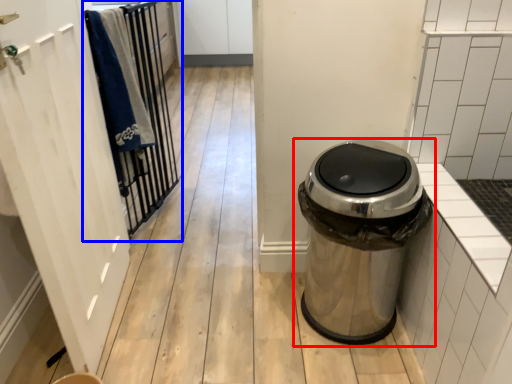
Question: Which point is closer to the camera, waste container (highlighted by a red box) or closet (highlighted by a blue box)?

Choices:
 (A) waste container
 (B) closet

Answer: (A)